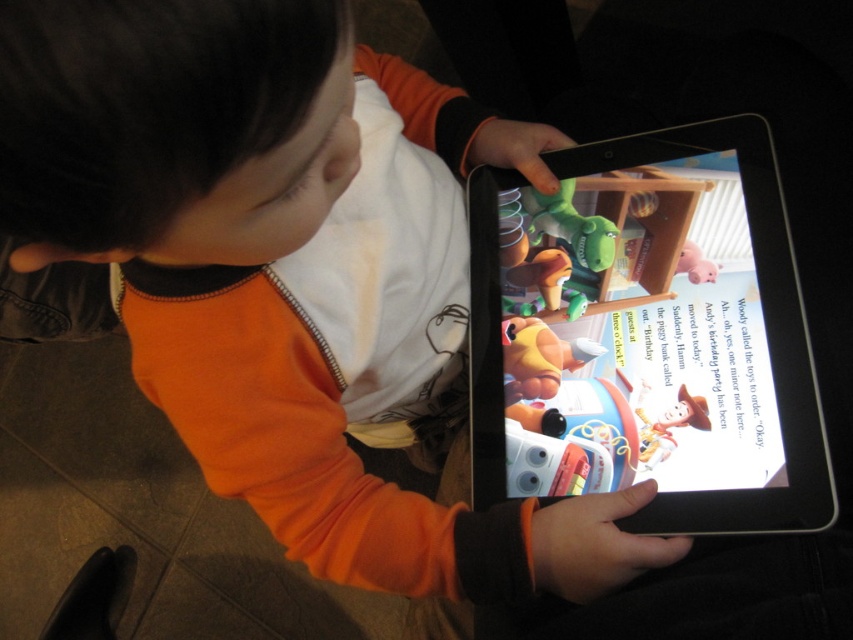
Which is behind, point (750, 529) or point (608, 262)?

The point (608, 262) is more distant.

Who is more forward, (584,468) or (534,216)?

Point (584,468) is more forward.

At what (x,y) coordinates should I click in order to perform the action: click on black plastic tablet at center. Please return your answer as a coordinate pair (x, y). The image size is (853, 640). Looking at the image, I should click on (660, 342).

Where is `black plastic tablet at center`? black plastic tablet at center is located at coordinates (660, 342).

Does black plastic tablet at center appear on the left side of yellow rubber duck at center?

In fact, black plastic tablet at center is to the right of yellow rubber duck at center.

This screenshot has height=640, width=853. What do you see at coordinates (660, 342) in the screenshot? I see `black plastic tablet at center` at bounding box center [660, 342].

The image size is (853, 640). Identify the location of black plastic tablet at center. (660, 342).

Which is below, matte green plush dinosaur at center or pink rubber pig at upper right?

pink rubber pig at upper right is below.

Which of these two, matte green plush dinosaur at center or pink rubber pig at upper right, stands shorter?

With less height is pink rubber pig at upper right.

Who is more distant from viewer, (570, 220) or (697, 262)?

The point (570, 220) is behind.

Where is `matte green plush dinosaur at center`? This screenshot has height=640, width=853. matte green plush dinosaur at center is located at coordinates (570, 225).